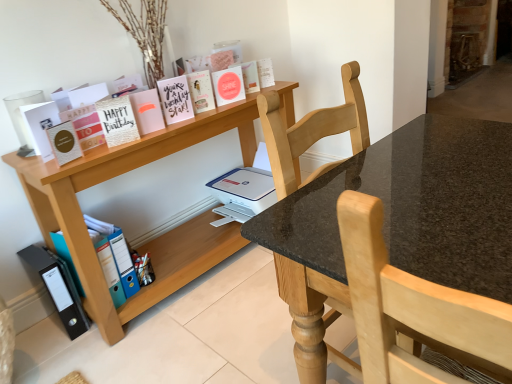
Locate an element on the screen. Image resolution: width=512 pixels, height=384 pixels. vacant area that is in front of gold textured card at upper left, marked as the 4th paperback book in a left-to-right arrangement is located at coordinates (106, 153).